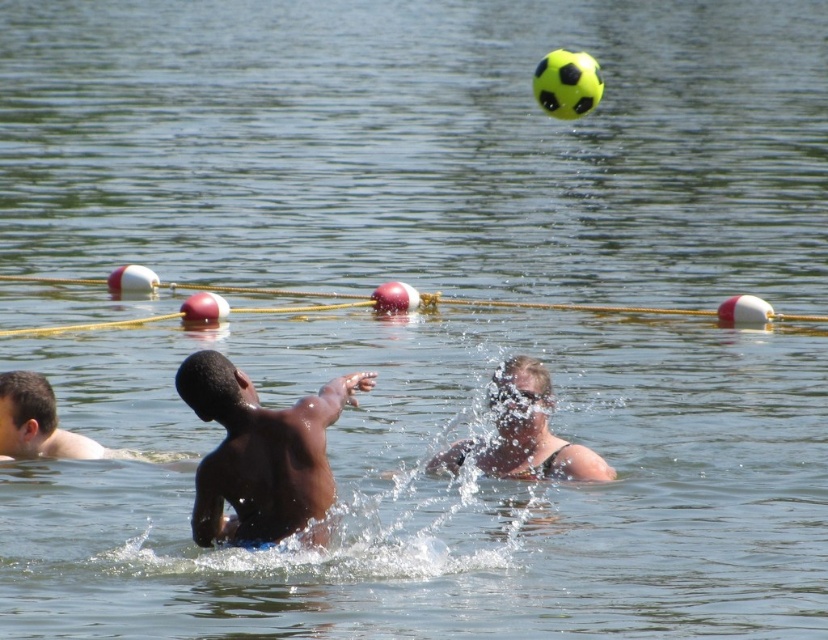
Question: Is smooth skin man at center above light brown skin at lower left?

Choices:
 (A) yes
 (B) no

Answer: (B)

Question: Does smooth skin man at center have a smaller size compared to light brown skin at lower left?

Choices:
 (A) no
 (B) yes

Answer: (A)

Question: Considering the real-world distances, which object is closest to the smooth skin man at center?

Choices:
 (A) light brown skin at lower left
 (B) dark skin human at center

Answer: (B)

Question: Is dark skin human at center below light brown skin at lower left?

Choices:
 (A) no
 (B) yes

Answer: (A)

Question: Which of the following is the closest to the observer?

Choices:
 (A) smooth skin man at center
 (B) light brown skin at lower left

Answer: (A)

Question: Which point is farther to the camera?

Choices:
 (A) light brown skin at lower left
 (B) dark skin human at center
 (C) smooth skin man at center

Answer: (A)